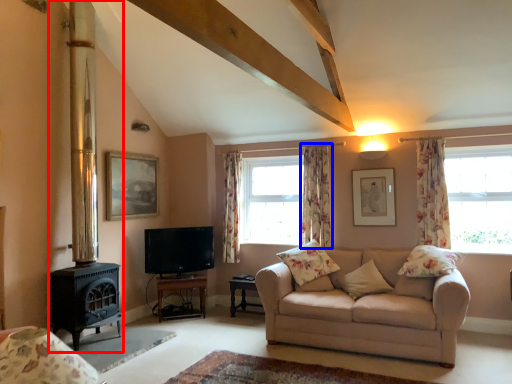
Question: Which object is closer to the camera taking this photo, fireplace (highlighted by a red box) or curtain (highlighted by a blue box)?

Choices:
 (A) fireplace
 (B) curtain

Answer: (A)